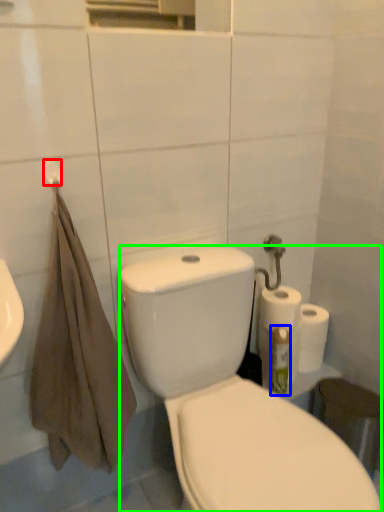
Question: Based on their relative distances, which object is nearer to towel bar (highlighted by a red box)? Choose from cleaning product (highlighted by a blue box) and porcelain (highlighted by a green box).

Choices:
 (A) cleaning product
 (B) porcelain

Answer: (B)